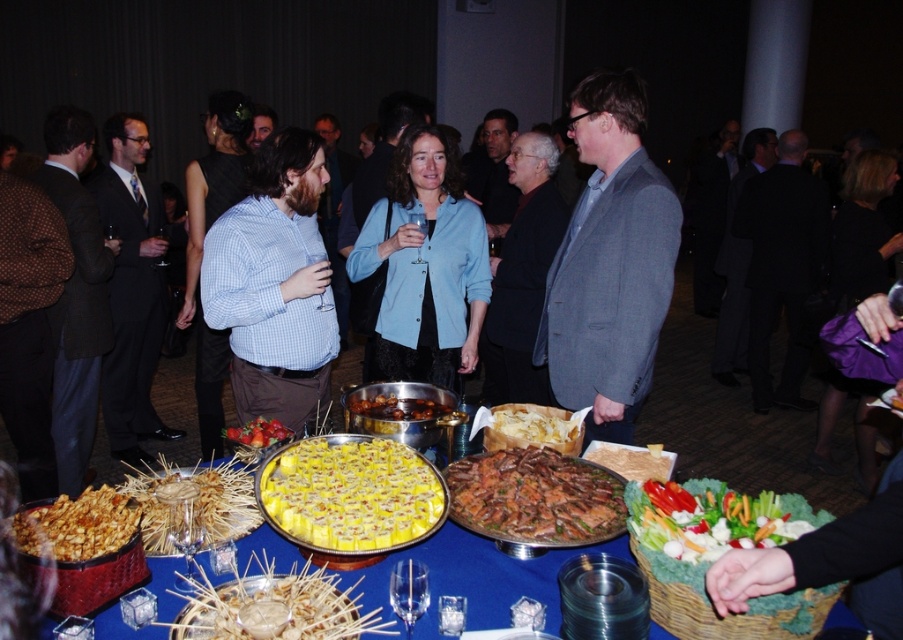
Question: Which object appears closest to the camera in this image?

Choices:
 (A) polka dot blazer at left
 (B) golden crispy snack at lower left
 (C) fresh red strawberries at center
 (D) transparent glass at center

Answer: (D)

Question: Which point is farther to the camera?

Choices:
 (A) fresh green salad at center
 (B) fresh red strawberries at center
 (C) blue checkered shirt at center

Answer: (C)

Question: Does golden crispy snack at lower left come behind fresh red strawberries at center?

Choices:
 (A) no
 (B) yes

Answer: (A)

Question: Is light blue button-up shirt at center positioned in front of brown glossy nuts at center?

Choices:
 (A) no
 (B) yes

Answer: (A)

Question: Which point is closer to the camera?

Choices:
 (A) (117, 436)
 (B) (391, 410)
 (C) (128, 502)
 (D) (582, 417)

Answer: (C)

Question: Is light blue button-up shirt at center bigger than yellow paper rolls at center?

Choices:
 (A) yes
 (B) no

Answer: (A)